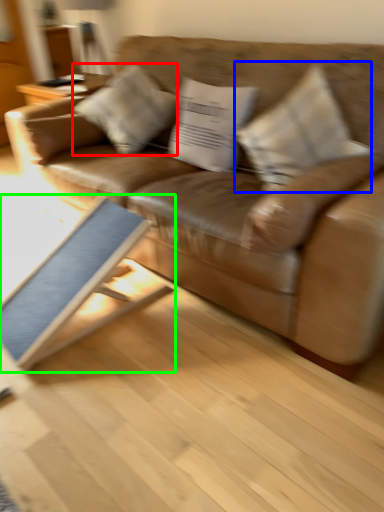
Question: Which object is the farthest from pillow (highlighted by a red box)? Choose among these: pillow (highlighted by a blue box) or table (highlighted by a green box).

Choices:
 (A) pillow
 (B) table

Answer: (A)